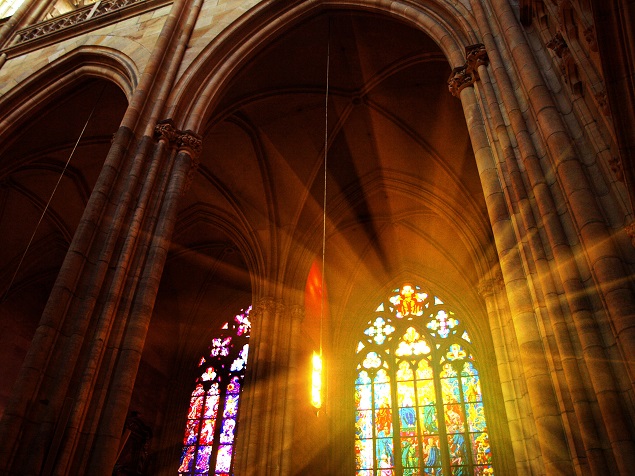
Where is `stained glass window , right of center`? Image resolution: width=635 pixels, height=476 pixels. stained glass window , right of center is located at coordinates (422, 413).